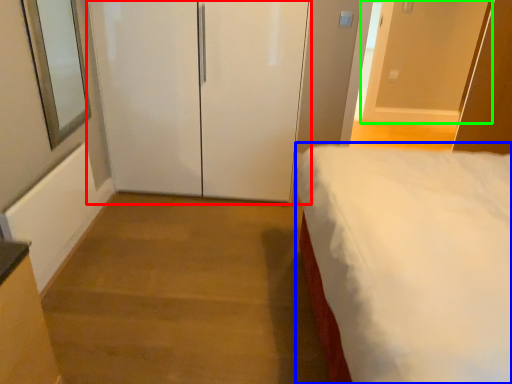
Question: Based on their relative distances, which object is farther from door (highlighted by a red box)? Choose from bed (highlighted by a blue box) and door (highlighted by a green box).

Choices:
 (A) bed
 (B) door

Answer: (B)